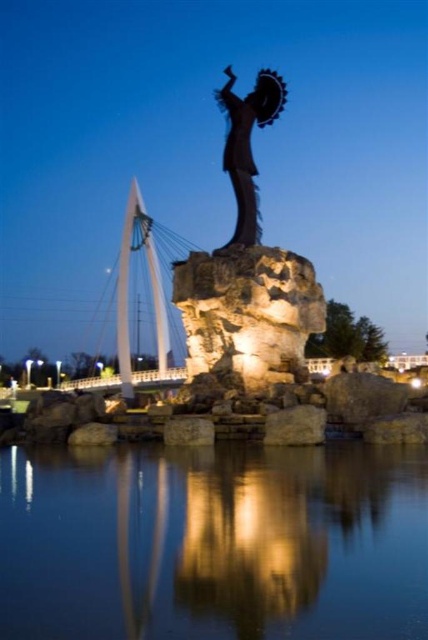
You are standing at the edge of the water and want to place a small decorative item exactly at the location of the smooth beige rock at center. According to the coordinates provided, where should you place it?

The smooth beige rock at center is located at coordinates point (294,426), so you should place the item there.

Consider the image. You are a photographer planning to capture the reflection of the sculpture in the water. You notice a smooth beige rock at center located at point [294,426]. Would positioning your camera near this rock improve the reflection quality?

The smooth beige rock at center at point [294,426] is located at the center, so positioning the camera near it would center the reflection, potentially improving symmetry and clarity in the photograph.